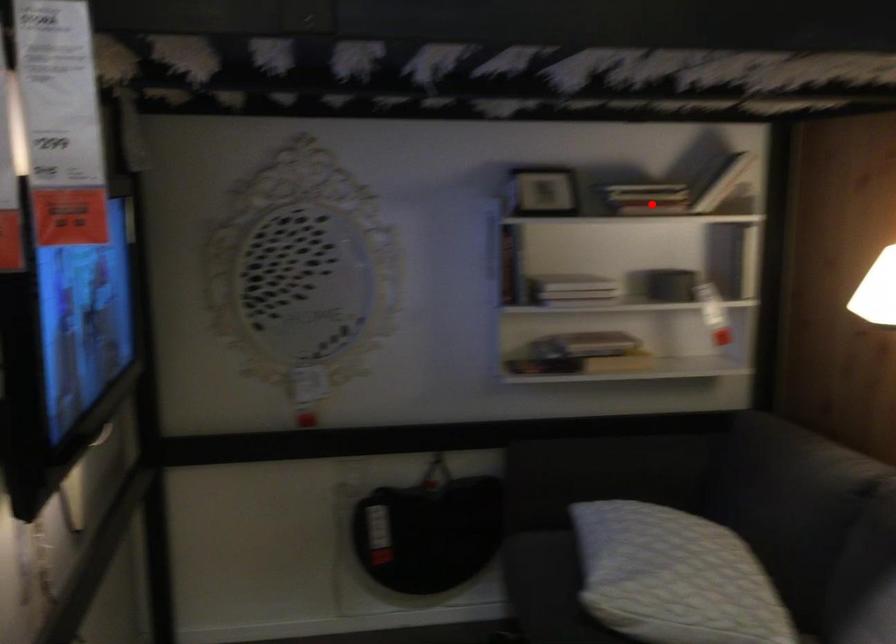
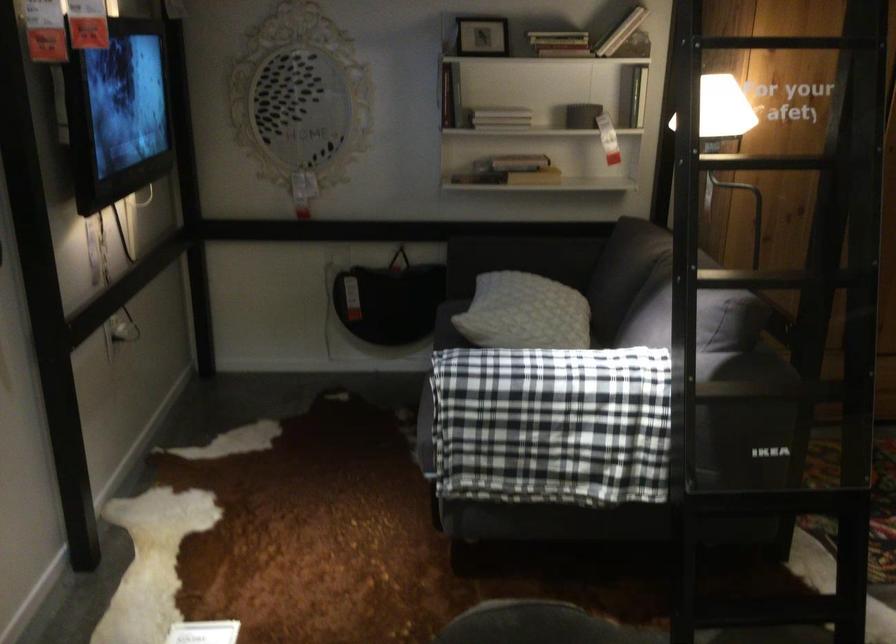
The point at the highlighted location is marked in the first image. Where is the corresponding point in the second image?

(558, 43)